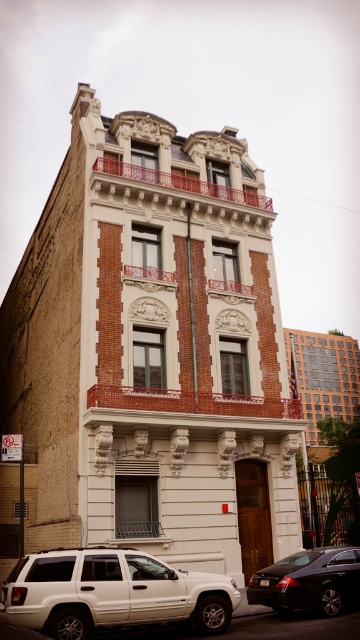
Question: Among these points, which one is farthest from the camera?

Choices:
 (A) (204, 620)
 (B) (317, 602)

Answer: (B)

Question: Can you confirm if white matte suv at lower left is positioned below shiny black sedan at lower right?

Choices:
 (A) no
 (B) yes

Answer: (A)

Question: Where is white matte suv at lower left located in relation to shiny black sedan at lower right in the image?

Choices:
 (A) left
 (B) right

Answer: (A)

Question: Among these objects, which one is nearest to the camera?

Choices:
 (A) white matte suv at lower left
 (B) shiny black sedan at lower right

Answer: (A)

Question: Is white matte suv at lower left below shiny black sedan at lower right?

Choices:
 (A) no
 (B) yes

Answer: (A)